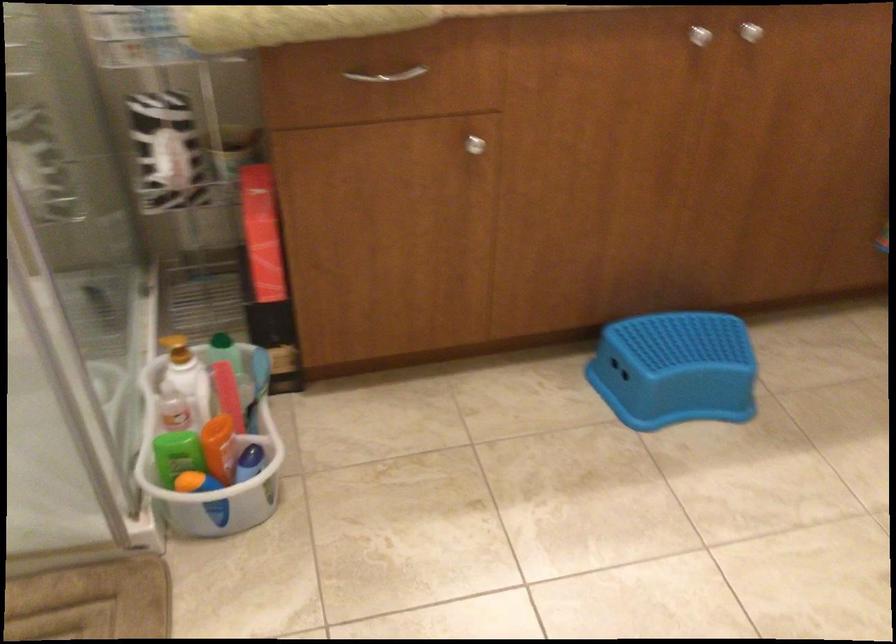
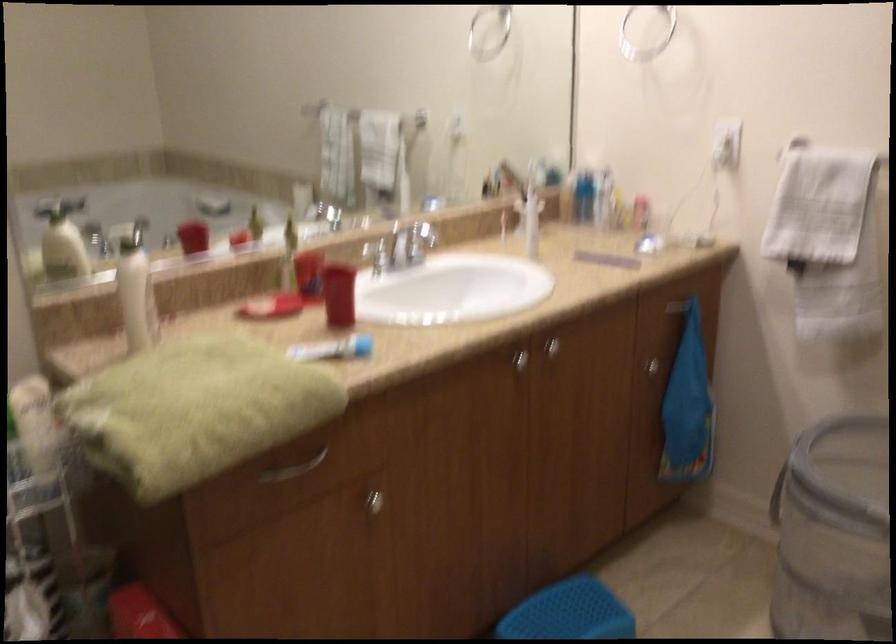
Locate, in the second image, the point that corresponds to (x=394, y=80) in the first image.

(294, 468)